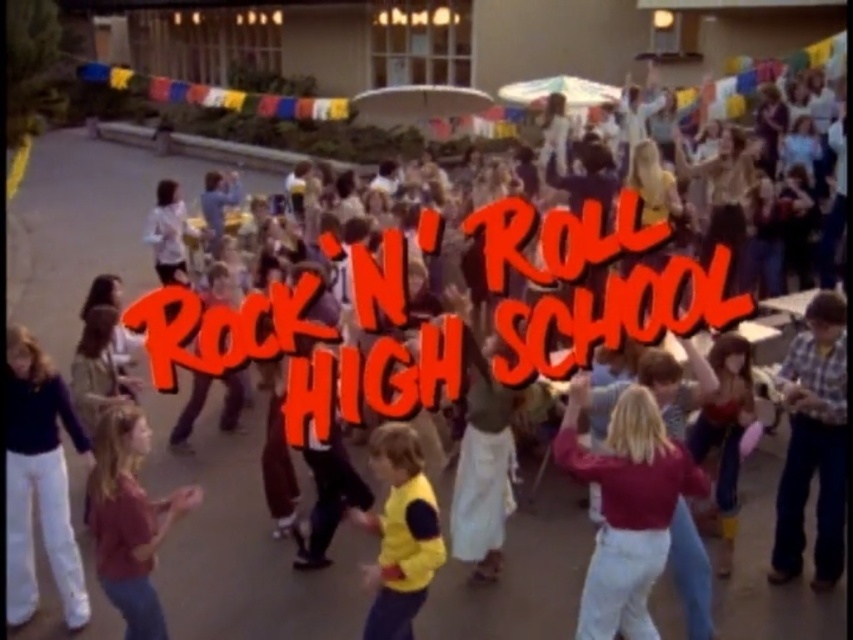
You are a photographer trying to capture both the matte red sweater at center and the matte pink shirt at center in a single frame. Since the sweater is taller than the shirt, which object should you focus on to ensure both are in the frame without cropping?

The matte red sweater at center is taller than the matte pink shirt at center, so you should focus on the matte red sweater at center to ensure both are in the frame without cropping.

You are a photographer at the event and need to capture both the matte pink shirt at center and the yellow fleece vest at center in a single shot. Which person should you position closer to the camera to ensure both are fully visible?

The matte pink shirt at center is much taller than the yellow fleece vest at center. To ensure both are fully visible in the photo, position the person wearing the yellow fleece vest at center closer to the camera since they are shorter, allowing their full height to be captured while the taller matte pink shirt at center can be framed appropriately.